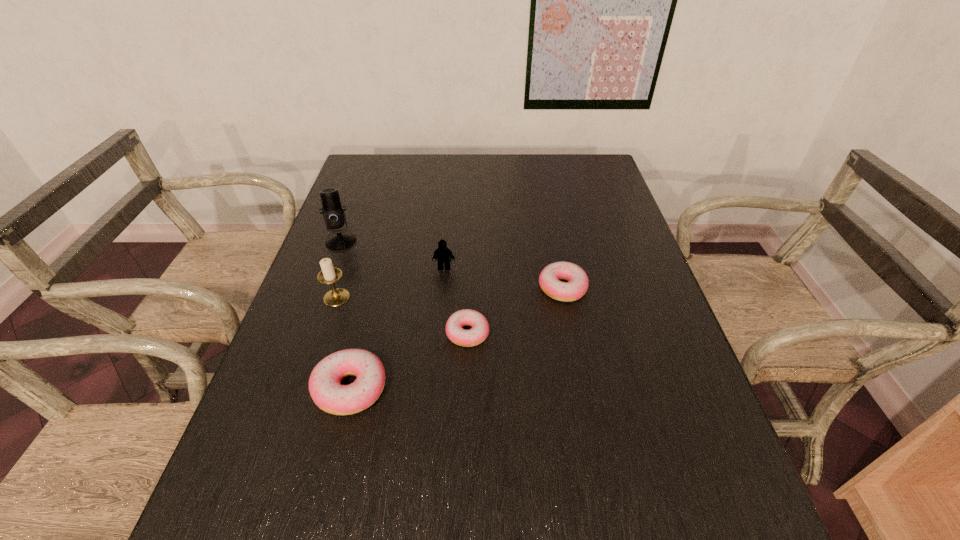
Find the location of `free spot between the second tallest doughnut and the microphone`. free spot between the second tallest doughnut and the microphone is located at coordinates (451, 264).

You are a GUI agent. You are given a task and a screenshot of the screen. Output one action in this format:
    pyautogui.click(x=<x>, y=<y>)
    Task: Click on the free spot between the rightmost object and the fourth shortest object
    The image size is (960, 540).
    Given the screenshot: What is the action you would take?
    pyautogui.click(x=503, y=278)

I want to click on empty space that is in between the farthest object and the second farthest object, so click(x=393, y=254).

Image resolution: width=960 pixels, height=540 pixels. What are the coordinates of `unoccupied area between the fourth shortest object and the shortest doughnut` in the screenshot? It's located at (456, 300).

At what (x,y) coordinates should I click in order to perform the action: click on empty space that is in between the leftmost doughnut and the farthest object. Please return your answer as a coordinate pair (x, y). This screenshot has width=960, height=540. Looking at the image, I should click on (346, 315).

Where is `empty location between the second tallest doughnut and the second nearest doughnut`? empty location between the second tallest doughnut and the second nearest doughnut is located at coordinates (516, 310).

Identify which object is the third nearest to the fifth nearest object. Please provide its 2D coordinates. Your answer should be formatted as a tuple, i.e. [(x, y)], where the tuple contains the x and y coordinates of a point satisfying the conditions above.

[(549, 279)]

Find the location of a particular element. The width and height of the screenshot is (960, 540). object identified as the third closest to the second shortest doughnut is located at coordinates (329, 395).

The image size is (960, 540). What are the coordinates of `doughnut identified as the second closest to the rightmost doughnut` in the screenshot? It's located at (329, 395).

The width and height of the screenshot is (960, 540). I want to click on doughnut that stands as the third closest to the fifth nearest object, so click(x=329, y=395).